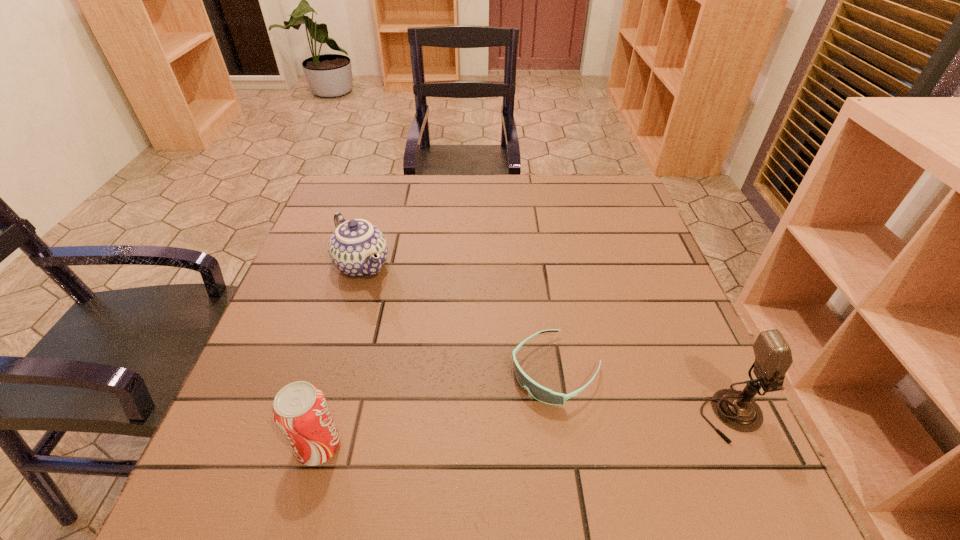
Image resolution: width=960 pixels, height=540 pixels. I want to click on vacant space on the desktop that is between the soda can and the microphone and is positioned from the spout of the chinaware, so click(x=493, y=433).

Locate an element on the screen. The image size is (960, 540). free space on the desktop that is between the soda can and the microphone and is positioned on the front-facing side of the goggles is located at coordinates (479, 434).